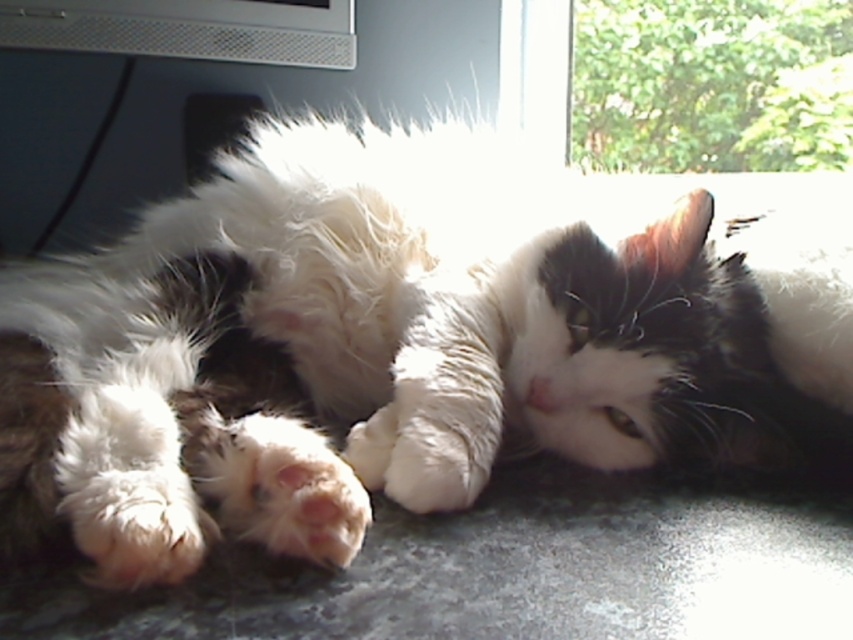
Question: Does green leafy foliage at upper right appear over metallic silver computer monitor at upper center?

Choices:
 (A) no
 (B) yes

Answer: (A)

Question: Which of the following is the farthest from the observer?

Choices:
 (A) click(x=589, y=10)
 (B) click(x=344, y=0)

Answer: (A)

Question: Does green leafy foliage at upper right appear over metallic silver computer monitor at upper center?

Choices:
 (A) no
 (B) yes

Answer: (A)

Question: Can you confirm if green leafy foliage at upper right is wider than metallic silver computer monitor at upper center?

Choices:
 (A) yes
 (B) no

Answer: (A)